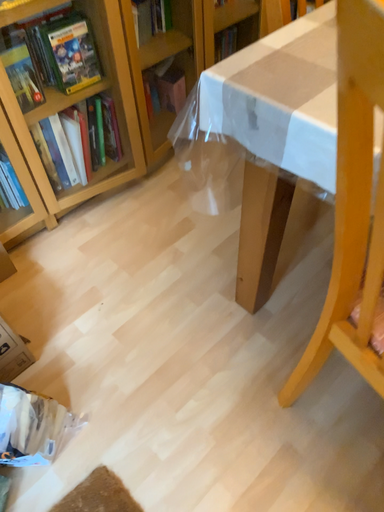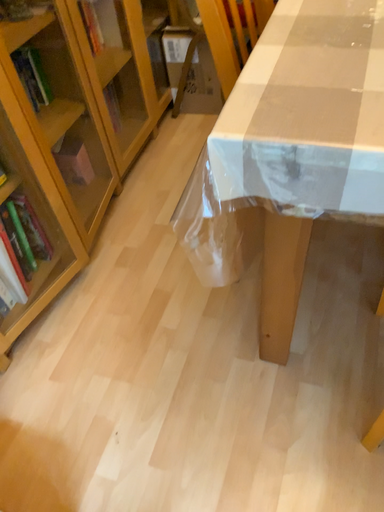
Question: Which way did the camera rotate in the video?

Choices:
 (A) rotated left
 (B) rotated right

Answer: (B)